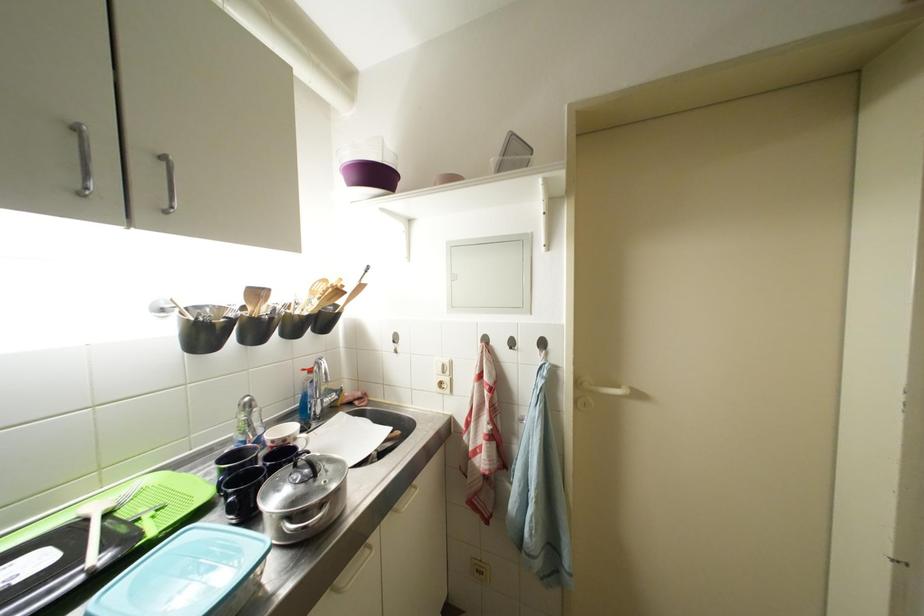
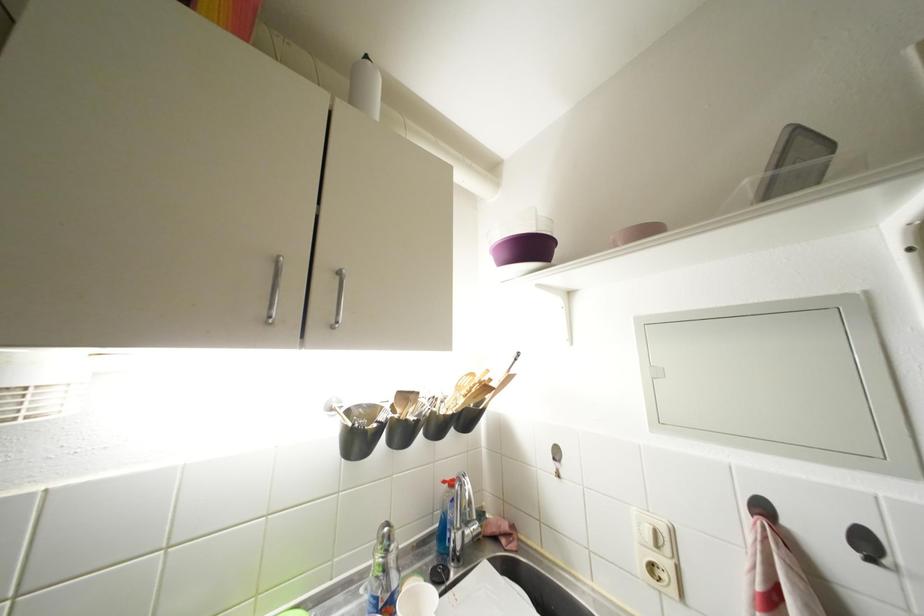
The point at (332, 285) is marked in the first image. Where is the corresponding point in the second image?

(479, 379)